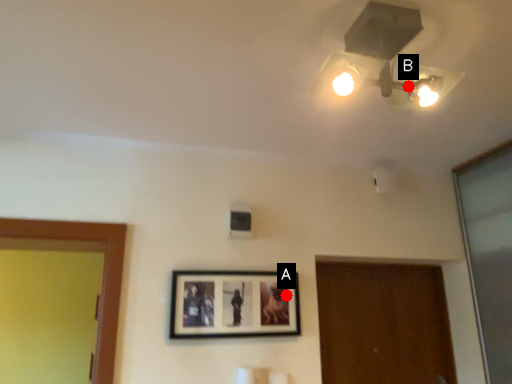
Question: Two points are circled on the image, labeled by A and B beside each circle. Which of the following is the closest to the observer?

Choices:
 (A) A is closer
 (B) B is closer

Answer: (B)